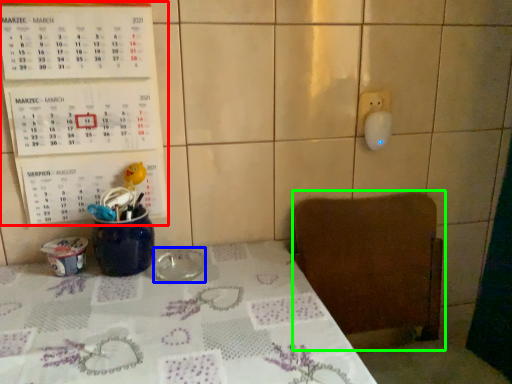
Question: Which is farther away from bulletin board (highlighted by a red box)? tableware (highlighted by a blue box) or chair (highlighted by a green box)?

Choices:
 (A) tableware
 (B) chair

Answer: (B)